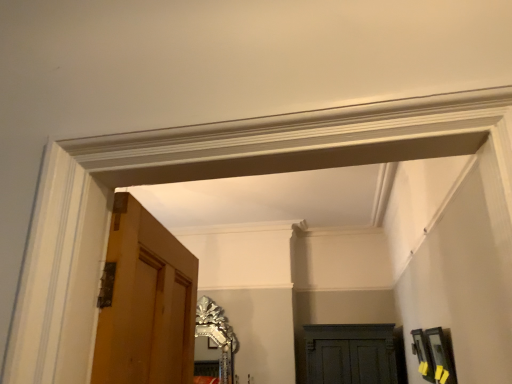
What do you see at coordinates (217, 335) in the screenshot? I see `silver metallic mirror at center` at bounding box center [217, 335].

This screenshot has height=384, width=512. Find the location of `silver metallic mirror at center`. silver metallic mirror at center is located at coordinates (217, 335).

This screenshot has height=384, width=512. In order to click on silver metallic mirror at center in this screenshot , I will do `click(217, 335)`.